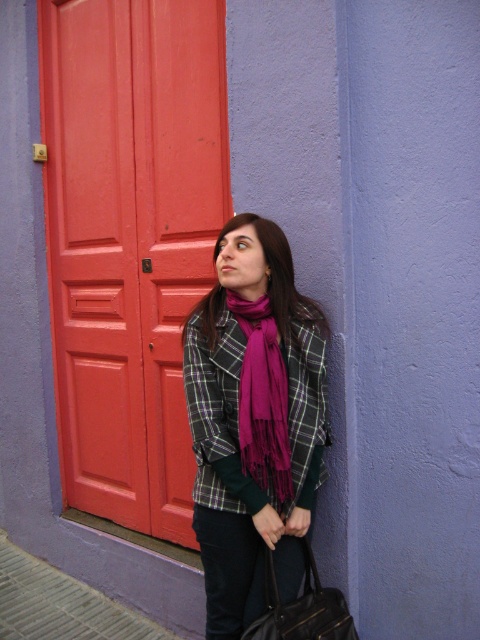
Which of these two, plaid woolen jacket at center or plaid fabric at center, stands taller?

plaid woolen jacket at center is taller.

At what (x,y) coordinates should I click in order to perform the action: click on plaid woolen jacket at center. Please return your answer as a coordinate pair (x, y). Image resolution: width=480 pixels, height=640 pixels. Looking at the image, I should click on (252, 420).

Where is `plaid woolen jacket at center`? plaid woolen jacket at center is located at coordinates (252, 420).

Who is taller, plaid fabric at center or purple fringed scarf at center?

plaid fabric at center is taller.

Which is above, plaid fabric at center or purple fringed scarf at center?

purple fringed scarf at center

What do you see at coordinates (238, 413) in the screenshot?
I see `plaid fabric at center` at bounding box center [238, 413].

This screenshot has width=480, height=640. I want to click on plaid fabric at center, so click(238, 413).

Does point (232, 552) come behind point (324, 636)?

Yes.

The height and width of the screenshot is (640, 480). What are the coordinates of `plaid woolen jacket at center` in the screenshot? It's located at (252, 420).